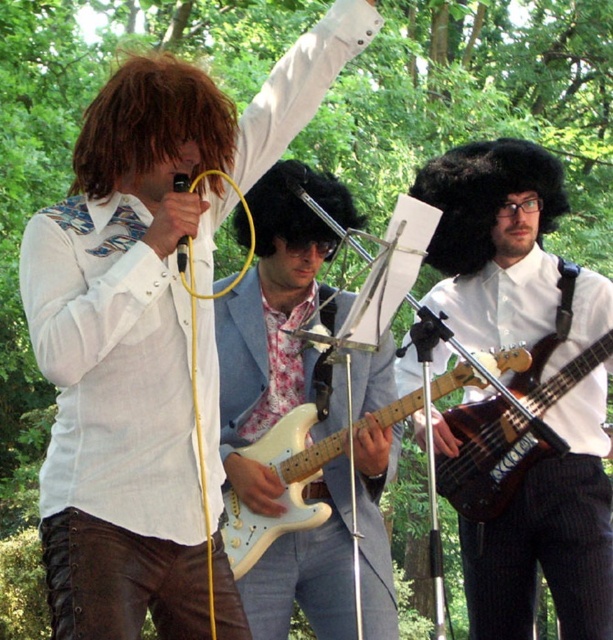
Question: Considering the real-world distances, which object is closest to the shiny brown bass guitar at center?

Choices:
 (A) matte white guitar at center
 (B) black fuzzy wig at center

Answer: (B)

Question: Estimate the real-world distances between objects in this image. Which object is closer to the dark brown wood bass at center?

Choices:
 (A) light blue fabric jacket at center
 (B) black fuzzy wig at center

Answer: (A)

Question: Is dark brown wood bass at center smaller than curly black wig at center?

Choices:
 (A) no
 (B) yes

Answer: (A)

Question: Can you confirm if shiny brown bass guitar at center is bigger than light blue fabric jacket at center?

Choices:
 (A) yes
 (B) no

Answer: (A)

Question: Does shiny brown bass guitar at center have a greater width compared to black fuzzy wig at center?

Choices:
 (A) no
 (B) yes

Answer: (B)

Question: Which is farther from the matte white guitar at center?

Choices:
 (A) white glossy electric guitar at center
 (B) curly black wig at center
 (C) shiny brown bass guitar at center
 (D) dark brown wood bass at center

Answer: (D)